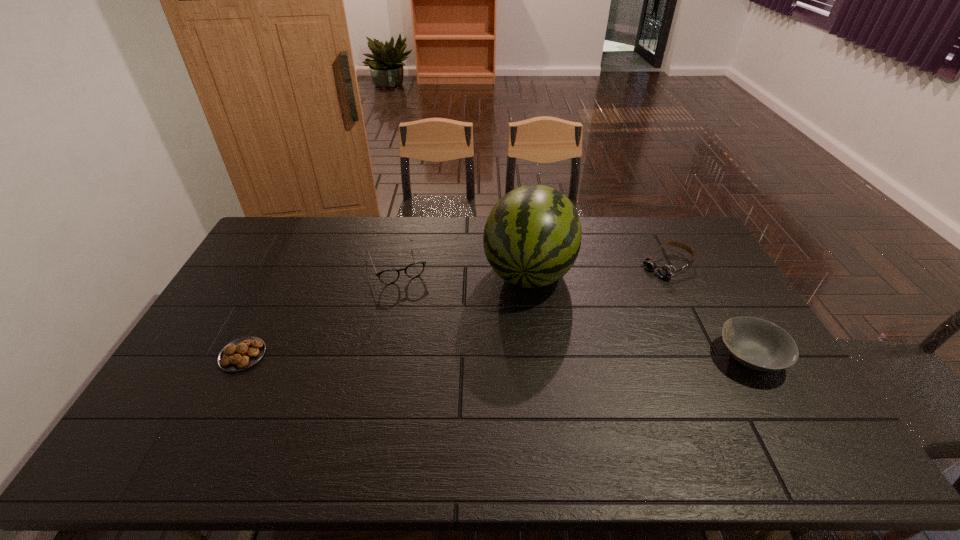
Find the location of a particular element. vacant spot on the desktop that is between the shortest object and the bowl and is positioned on the front-facing side of the goggles is located at coordinates pos(531,356).

This screenshot has width=960, height=540. Identify the location of vacant space on the desktop that is between the leftmost object and the fourth shortest object and is positioned at the stem end of the third object from left to right. (508, 356).

Where is `vacant space on the desktop that is between the shortest object and the bowl and is positioned through the lenses of the fourth object from right to left`? vacant space on the desktop that is between the shortest object and the bowl and is positioned through the lenses of the fourth object from right to left is located at coordinates (437, 356).